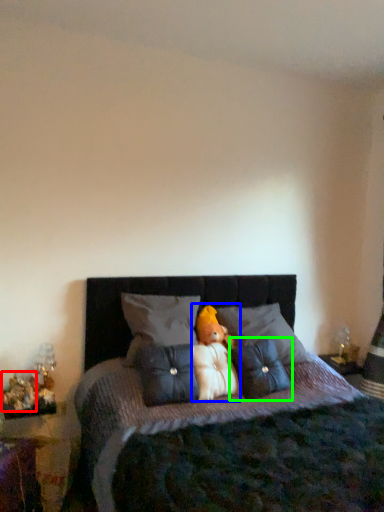
Question: Based on their relative distances, which object is farther from toy (highlighted by a red box)? Choose from doll (highlighted by a blue box) and pillow (highlighted by a green box).

Choices:
 (A) doll
 (B) pillow

Answer: (B)